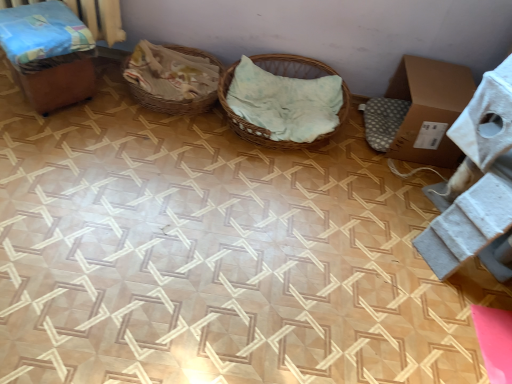
Image resolution: width=512 pixels, height=384 pixels. Identify the location of vacant space to the right of wooden box at left. (111, 120).